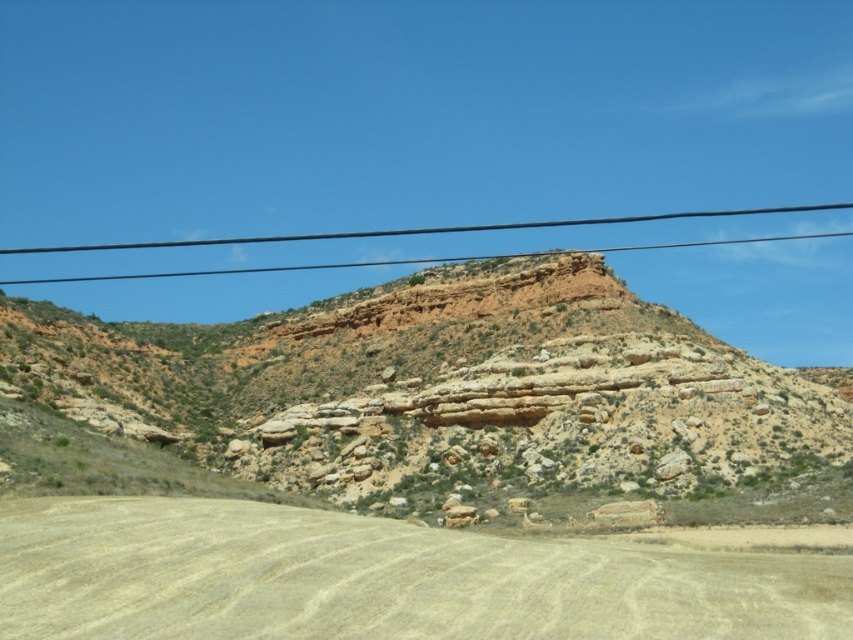
Does rustic rock formation at center have a lesser height compared to black wire at upper center?

Yes, rustic rock formation at center is shorter than black wire at upper center.

Is rustic rock formation at center thinner than black wire at upper center?

Yes, rustic rock formation at center is thinner than black wire at upper center.

Locate an element on the screen. Image resolution: width=853 pixels, height=640 pixels. rustic rock formation at center is located at coordinates (459, 397).

This screenshot has width=853, height=640. I want to click on rustic rock formation at center, so click(459, 397).

Which is above, rustic rock formation at center or light brown dirt track at lower center?

rustic rock formation at center is above.

Who is more forward, (646,388) or (749,593)?

Point (749,593) is in front.

Locate an element on the screen. rustic rock formation at center is located at coordinates (459, 397).

Who is more forward, [252,536] or [546,224]?

Positioned in front is point [252,536].

The width and height of the screenshot is (853, 640). Describe the element at coordinates (379, 579) in the screenshot. I see `light brown dirt track at lower center` at that location.

Identify the location of light brown dirt track at lower center. The width and height of the screenshot is (853, 640). (379, 579).